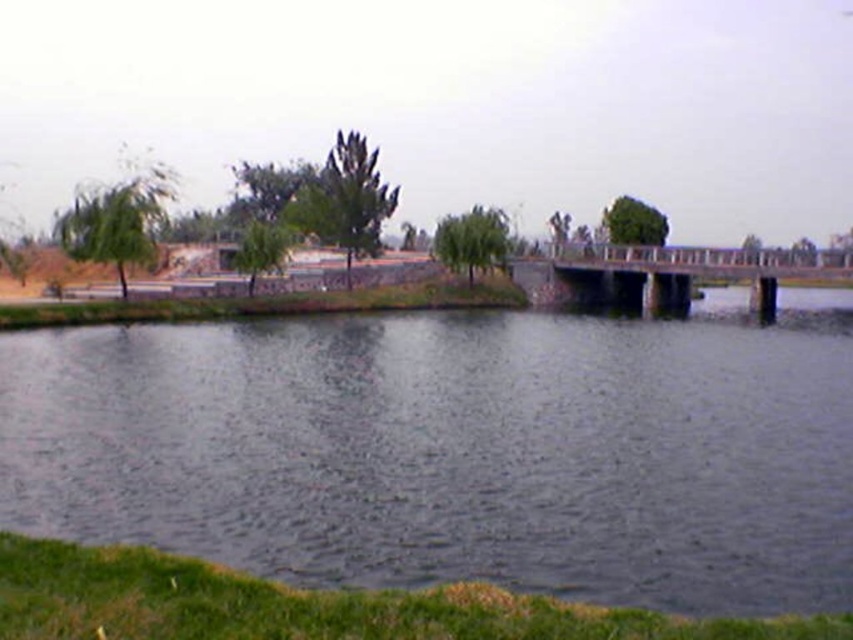
You are a boat operator who needs to navigate a boat through the water between the dark blue water at center and the concrete bridge at center. Can your boat pass through the space between them?

The dark blue water at center is wider than the concrete bridge at center. Since the water is wider, the boat can pass through the space between them as there is sufficient width available.

You are standing at the viewpoint of the image and want to determine the relative positions of two points in the scene. Which of the two points, point (611,461) or point (764,308), is closer to you?

Point (611,461) is closer to the camera than point (764,308).

In the scene shown: What is the color and location of the object represented by the point coordinates (457, 449) in the scene?

The point coordinates (457, 449) represent dark blue water at center.